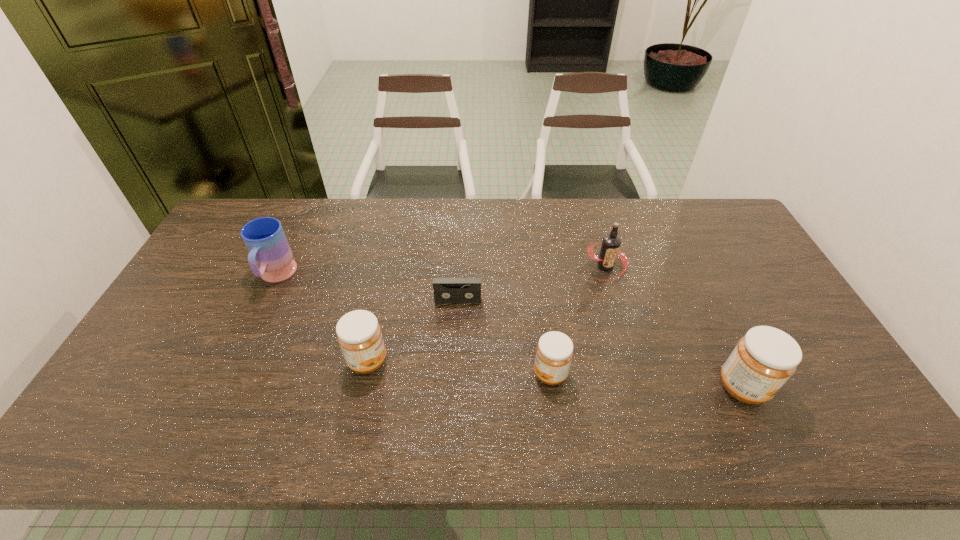
This screenshot has height=540, width=960. I want to click on the second tallest jam, so click(359, 335).

Identify the location of the fifth object from right to left. (359, 335).

Locate an element on the screen. This screenshot has width=960, height=540. the fifth tallest object is located at coordinates (554, 352).

The width and height of the screenshot is (960, 540). Identify the location of the second jam from left to right. (554, 352).

You are a GUI agent. You are given a task and a screenshot of the screen. Output one action in this format:
    pyautogui.click(x=<x>, y=<y>)
    Task: Click on the rightmost jam
    
    Given the screenshot: What is the action you would take?
    pyautogui.click(x=765, y=358)

Locate an element on the screen. the third farthest object is located at coordinates (446, 290).

The image size is (960, 540). Identify the location of the shortest object. (446, 290).

You are a GUI agent. You are given a task and a screenshot of the screen. Output one action in this format:
    pyautogui.click(x=<x>, y=<y>)
    Task: Click on the leftmost object
    
    Given the screenshot: What is the action you would take?
    pyautogui.click(x=270, y=257)

At what (x,y) coordinates should I click in order to perform the action: click on root beer. Please return your answer as a coordinate pair (x, y). This screenshot has height=540, width=960. Looking at the image, I should click on (x=611, y=243).

This screenshot has width=960, height=540. What are the coordinates of `free point located on the front label of the fifth object from right to left` in the screenshot? It's located at (498, 361).